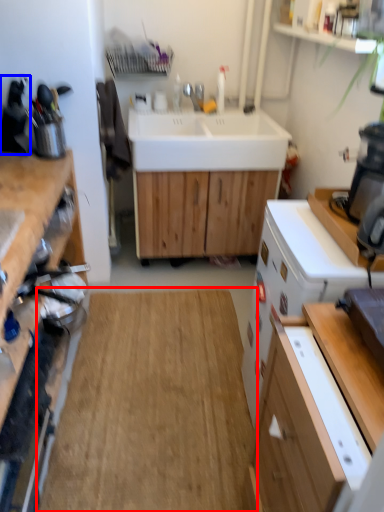
Question: Which point is closer to the camera, hardwood (highlighted by a red box) or appliance (highlighted by a blue box)?

Choices:
 (A) hardwood
 (B) appliance

Answer: (A)